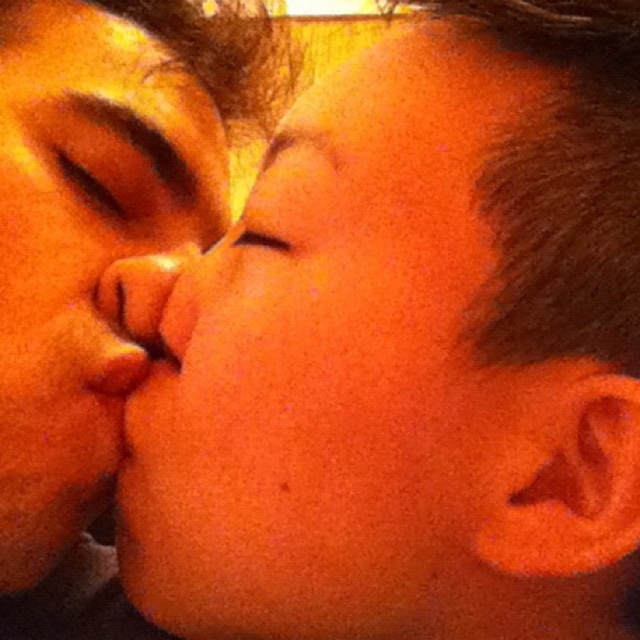
Question: Does matte skin face at center appear on the right side of matte orange eye at center?

Choices:
 (A) yes
 (B) no

Answer: (B)

Question: In this image, where is smooth skin face at center located relative to brown matte eye at upper left?

Choices:
 (A) below
 (B) above

Answer: (A)

Question: Among these points, which one is farthest from the camera?

Choices:
 (A) (136, 308)
 (B) (282, 248)
 (C) (417, 339)
 (D) (92, 145)

Answer: (D)

Question: Which object is closer to the camera taking this photo?

Choices:
 (A) brown matte eye at upper left
 (B) smooth skin face at center
 (C) matte skin face at center

Answer: (B)

Question: Does matte skin face at center lie in front of matte orange nose at center?

Choices:
 (A) yes
 (B) no

Answer: (A)

Question: Which object is positioned closest to the matte orange nose at center?

Choices:
 (A) matte skin face at center
 (B) matte orange eye at center
 (C) smooth skin face at center
 (D) brown matte eye at upper left

Answer: (D)